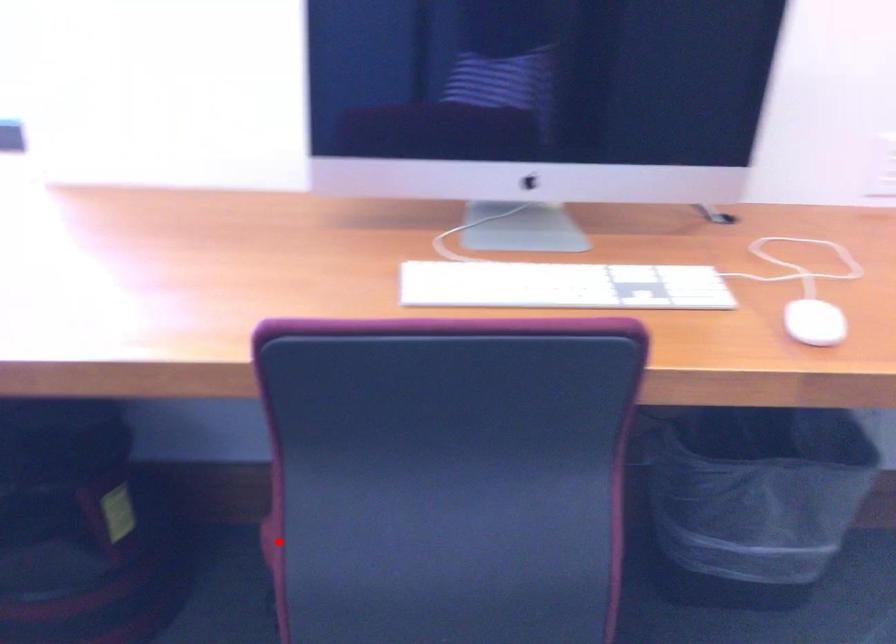
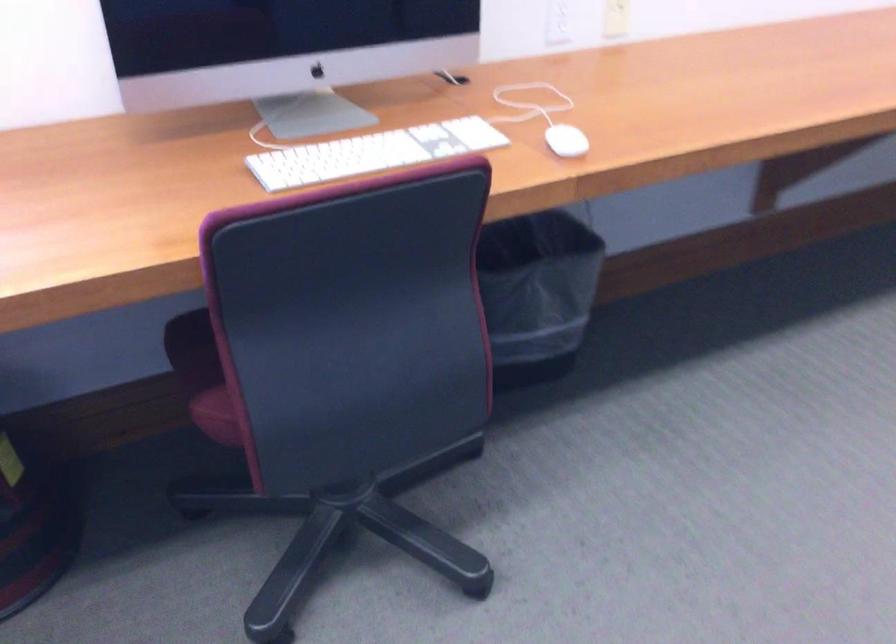
Question: I am providing you with two images of the same scene from different viewpoints. A red point is marked on the first image. At the location where the point appears in image 1, is it still visible in image 2?

Choices:
 (A) Yes
 (B) No

Answer: (A)